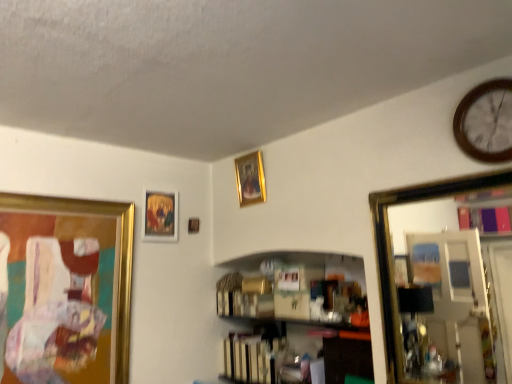
Where is `gold-framed painting at upper center, arranged as the 2th picture frame when viewed from the left`? Image resolution: width=512 pixels, height=384 pixels. gold-framed painting at upper center, arranged as the 2th picture frame when viewed from the left is located at coordinates (160, 216).

Image resolution: width=512 pixels, height=384 pixels. What do you see at coordinates (250, 179) in the screenshot? I see `gold metallic picture frame at upper center, which is the 1th picture frame in right-to-left order` at bounding box center [250, 179].

What do you see at coordinates (486, 122) in the screenshot? Image resolution: width=512 pixels, height=384 pixels. I see `brown wooden clock at upper right` at bounding box center [486, 122].

You are a GUI agent. You are given a task and a screenshot of the screen. Output one action in this format:
    pyautogui.click(x=<x>, y=<y>)
    Task: Click on the gold-framed painting at upper center, positioned as the 3th picture frame in right-to-left order
    
    Given the screenshot: What is the action you would take?
    pyautogui.click(x=160, y=216)

Which of these two, gold-framed painting at upper center, positioned as the 3th picture frame in right-to-left order, or gold metallic picture frame at upper center, which is the 1th picture frame in right-to-left order, is smaller?

gold-framed painting at upper center, positioned as the 3th picture frame in right-to-left order.

Are gold-framed painting at upper center, positioned as the 3th picture frame in right-to-left order, and gold metallic picture frame at upper center, positioned as the 4th picture frame in left-to-right order, located far from each other?

No, there isn't a large distance between gold-framed painting at upper center, positioned as the 3th picture frame in right-to-left order, and gold metallic picture frame at upper center, positioned as the 4th picture frame in left-to-right order.

Consider the image. Is gold-framed painting at upper center, positioned as the 3th picture frame in right-to-left order, located outside gold metallic picture frame at upper center, which is the 1th picture frame in right-to-left order?

Yes, gold-framed painting at upper center, positioned as the 3th picture frame in right-to-left order, is not within gold metallic picture frame at upper center, which is the 1th picture frame in right-to-left order.

Consider the image. Does gold metallic picture frame at upper center, positioned as the 4th picture frame in left-to-right order, touch gold-framed mirror at right?

No, gold metallic picture frame at upper center, positioned as the 4th picture frame in left-to-right order, is not next to gold-framed mirror at right.

Is gold metallic picture frame at upper center, which is the 1th picture frame in right-to-left order, positioned behind gold-framed mirror at right?

Yes, gold metallic picture frame at upper center, which is the 1th picture frame in right-to-left order, is further from the viewer.

Considering the relative sizes of gold metallic picture frame at upper center, positioned as the 4th picture frame in left-to-right order, and gold-framed mirror at right in the image provided, is gold metallic picture frame at upper center, positioned as the 4th picture frame in left-to-right order, bigger than gold-framed mirror at right?

Incorrect, gold metallic picture frame at upper center, positioned as the 4th picture frame in left-to-right order, is not larger than gold-framed mirror at right.

Is gold metallic picture frame at upper center, positioned as the 4th picture frame in left-to-right order, facing towards gold-framed mirror at right?

No.

Is point (119, 373) farther from viewer compared to point (392, 312)?

Yes, it is.

Considering the sizes of objects gold metallic picture frame at left, the 1th picture frame from the left, and gold-framed mirror at right in the image provided, who is bigger, gold metallic picture frame at left, the 1th picture frame from the left, or gold-framed mirror at right?

With larger size is gold metallic picture frame at left, the 1th picture frame from the left.

Considering the sizes of objects gold metallic picture frame at left, the 4th picture frame when ordered from right to left, and gold-framed mirror at right in the image provided, who is shorter, gold metallic picture frame at left, the 4th picture frame when ordered from right to left, or gold-framed mirror at right?

With less height is gold-framed mirror at right.

In the image, is gold metallic picture frame at left, the 1th picture frame from the left, on the left side or the right side of gold-framed mirror at right?

gold metallic picture frame at left, the 1th picture frame from the left, is positioned on gold-framed mirror at right's left side.

Image resolution: width=512 pixels, height=384 pixels. I want to click on mirror on the right side of gold-framed painting at upper center, positioned as the 3th picture frame in right-to-left order, so click(391, 250).

Are gold-framed painting at upper center, arranged as the 2th picture frame when viewed from the left, and gold-framed mirror at right located far from each other?

Yes, gold-framed painting at upper center, arranged as the 2th picture frame when viewed from the left, is far from gold-framed mirror at right.

Which is in front, point (163, 213) or point (424, 199)?

The point (424, 199) is closer to the camera.

How different are the orientations of gold-framed painting at upper center, positioned as the 3th picture frame in right-to-left order, and gold-framed mirror at right in degrees?

There is a 87.4-degree angle between the facing directions of gold-framed painting at upper center, positioned as the 3th picture frame in right-to-left order, and gold-framed mirror at right.

I want to click on picture frame below the gold-framed mirror at right (from a real-world perspective), so click(x=66, y=289).

Considering the positions of point (425, 193) and point (20, 223), is point (425, 193) closer or farther from the camera than point (20, 223)?

Point (425, 193) appears to be closer to the viewer than point (20, 223).

Who is bigger, gold-framed mirror at right or gold metallic picture frame at left, the 1th picture frame from the left?

With larger size is gold metallic picture frame at left, the 1th picture frame from the left.

In terms of width, does wooden picture frame at upper center, which is the second picture frame in right-to-left order, look wider or thinner when compared to brown wooden clock at upper right?

wooden picture frame at upper center, which is the second picture frame in right-to-left order, is thinner than brown wooden clock at upper right.

Are wooden picture frame at upper center, marked as the third picture frame in a left-to-right arrangement, and brown wooden clock at upper right making contact?

wooden picture frame at upper center, marked as the third picture frame in a left-to-right arrangement, is not next to brown wooden clock at upper right, and they're not touching.

From a real-world perspective, is wooden picture frame at upper center, which is the second picture frame in right-to-left order, below brown wooden clock at upper right?

Yes.

Can you confirm if wooden picture frame at upper center, marked as the third picture frame in a left-to-right arrangement, is positioned to the right of gold metallic picture frame at left, the 1th picture frame from the left?

Yes, wooden picture frame at upper center, marked as the third picture frame in a left-to-right arrangement, is to the right of gold metallic picture frame at left, the 1th picture frame from the left.

Considering the relative positions of wooden picture frame at upper center, which is the second picture frame in right-to-left order, and gold metallic picture frame at left, the 4th picture frame when ordered from right to left, in the image provided, is wooden picture frame at upper center, which is the second picture frame in right-to-left order, behind gold metallic picture frame at left, the 4th picture frame when ordered from right to left,?

Yes, it is.

Which is more distant, [198,226] or [123,328]?

The point [198,226] is behind.

Is wooden picture frame at upper center, which is the second picture frame in right-to-left order, completely or partially outside of gold metallic picture frame at left, the 4th picture frame when ordered from right to left?

Indeed, wooden picture frame at upper center, which is the second picture frame in right-to-left order, is completely outside gold metallic picture frame at left, the 4th picture frame when ordered from right to left.

What are the coordinates of `the 1st picture frame behind when counting from the gold metallic picture frame at upper center, which is the 1th picture frame in right-to-left order` in the screenshot? It's located at (160, 216).

You are a GUI agent. You are given a task and a screenshot of the screen. Output one action in this format:
    pyautogui.click(x=<x>, y=<y>)
    Task: Click on the mirror below the gold metallic picture frame at upper center, which is the 1th picture frame in right-to-left order (from the image's perspective)
    This screenshot has height=384, width=512.
    Given the screenshot: What is the action you would take?
    pyautogui.click(x=391, y=250)

Considering their positions, is gold-framed painting at upper center, arranged as the 2th picture frame when viewed from the left, positioned further to gold metallic picture frame at upper center, which is the 1th picture frame in right-to-left order, than brown wooden clock at upper right?

brown wooden clock at upper right lies further to gold metallic picture frame at upper center, which is the 1th picture frame in right-to-left order, than the other object.

Based on their spatial positions, is gold-framed painting at upper center, positioned as the 3th picture frame in right-to-left order, or wooden picture frame at upper center, marked as the third picture frame in a left-to-right arrangement, further from gold metallic picture frame at left, the 1th picture frame from the left?

wooden picture frame at upper center, marked as the third picture frame in a left-to-right arrangement, is further to gold metallic picture frame at left, the 1th picture frame from the left.

Considering their positions, is brown wooden clock at upper right positioned further to wooden picture frame at upper center, marked as the third picture frame in a left-to-right arrangement, than gold metallic picture frame at left, the 4th picture frame when ordered from right to left?

brown wooden clock at upper right is further to wooden picture frame at upper center, marked as the third picture frame in a left-to-right arrangement.

Looking at the image, which one is located closer to wooden picture frame at upper center, marked as the third picture frame in a left-to-right arrangement, gold metallic picture frame at left, the 1th picture frame from the left, or brown wooden clock at upper right?

The object closer to wooden picture frame at upper center, marked as the third picture frame in a left-to-right arrangement, is gold metallic picture frame at left, the 1th picture frame from the left.

Consider the image. Considering their positions, is gold metallic picture frame at left, the 4th picture frame when ordered from right to left, positioned closer to brown wooden clock at upper right than wooden picture frame at upper center, which is the second picture frame in right-to-left order?

wooden picture frame at upper center, which is the second picture frame in right-to-left order.

From the image, which object appears to be farther from gold metallic picture frame at left, the 1th picture frame from the left, gold-framed painting at upper center, arranged as the 2th picture frame when viewed from the left, or gold-framed mirror at right?

Based on the image, gold-framed mirror at right appears to be further to gold metallic picture frame at left, the 1th picture frame from the left.

Looking at the image, which one is located closer to wooden picture frame at upper center, which is the second picture frame in right-to-left order, brown wooden clock at upper right or gold metallic picture frame at upper center, which is the 1th picture frame in right-to-left order?

gold metallic picture frame at upper center, which is the 1th picture frame in right-to-left order, is closer to wooden picture frame at upper center, which is the second picture frame in right-to-left order.

Considering their positions, is gold metallic picture frame at left, the 4th picture frame when ordered from right to left, positioned closer to gold-framed painting at upper center, arranged as the 2th picture frame when viewed from the left, than gold-framed mirror at right?

gold metallic picture frame at left, the 4th picture frame when ordered from right to left, is closer to gold-framed painting at upper center, arranged as the 2th picture frame when viewed from the left.

The image size is (512, 384). What are the coordinates of `clock between gold-framed mirror at right and wooden picture frame at upper center, marked as the third picture frame in a left-to-right arrangement, from front to back` in the screenshot? It's located at (486, 122).

Where is `mirror located between gold-framed painting at upper center, arranged as the 2th picture frame when viewed from the left, and brown wooden clock at upper right in the left-right direction`? mirror located between gold-framed painting at upper center, arranged as the 2th picture frame when viewed from the left, and brown wooden clock at upper right in the left-right direction is located at coordinates (391, 250).

I want to click on picture frame situated between gold-framed painting at upper center, positioned as the 3th picture frame in right-to-left order, and gold metallic picture frame at upper center, positioned as the 4th picture frame in left-to-right order, from left to right, so click(x=193, y=225).

Image resolution: width=512 pixels, height=384 pixels. I want to click on clock between gold-framed mirror at right and gold metallic picture frame at upper center, which is the 1th picture frame in right-to-left order, in the front-back direction, so click(x=486, y=122).